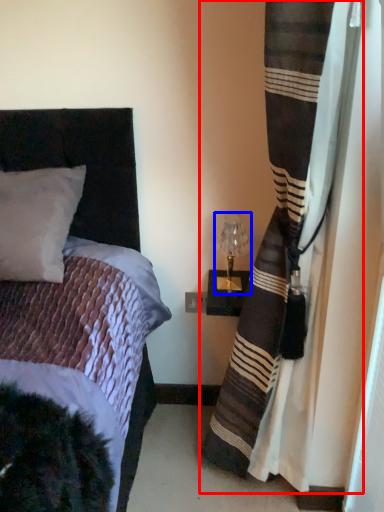
Question: Which object is closer to the camera taking this photo, curtain (highlighted by a red box) or table lamp (highlighted by a blue box)?

Choices:
 (A) curtain
 (B) table lamp

Answer: (A)